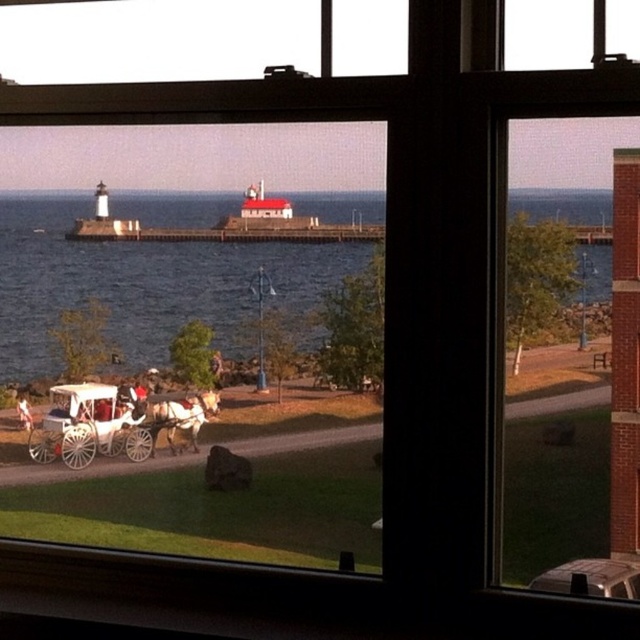
You are standing at the edge of the water and want to take a photo of the shiny brown horse at center. The camera you have can focus on objects up to 10 feet away. Will the horse be in focus?

The shiny brown horse at center is 9.04 feet from camera, so yes, the horse will be in focus since it is within the camera focus range of up to 10 feet.

You are standing at the edge of the blue water at center and want to reach the white fabric horse at lower left. Which direction should you move to get there?

You should move downward because the blue water at center is above the white fabric horse at lower left.